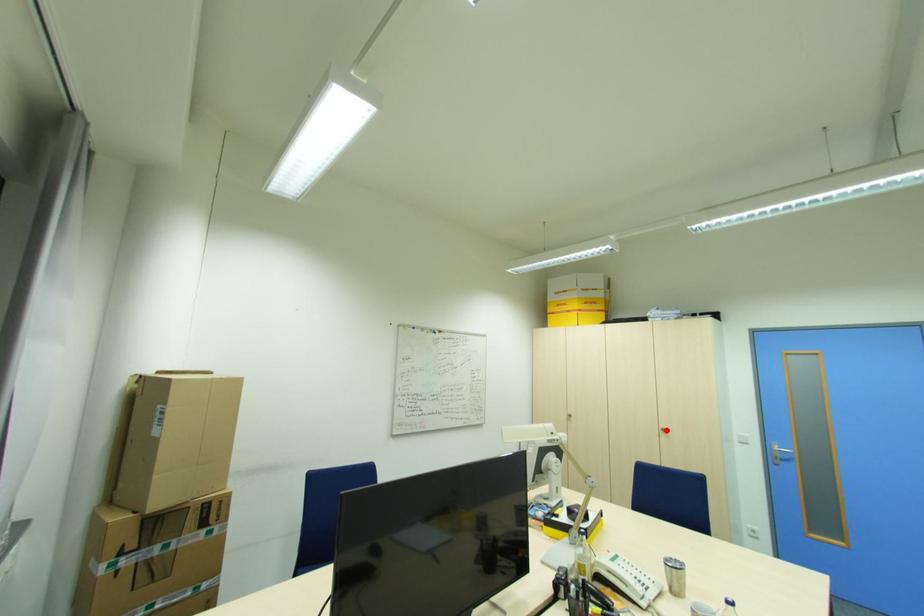
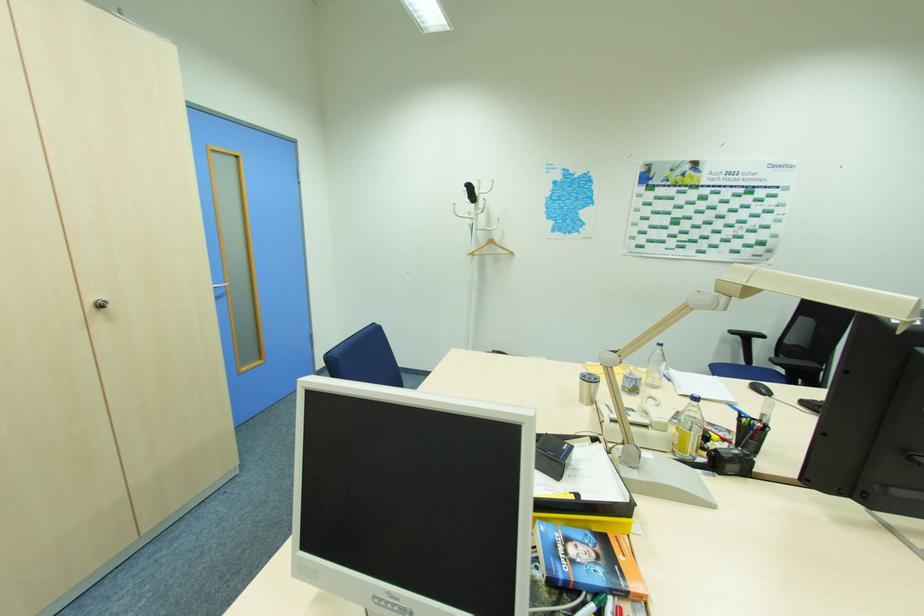
Locate, in the second image, the point that corresponds to the highlighted location in the first image.

(103, 306)